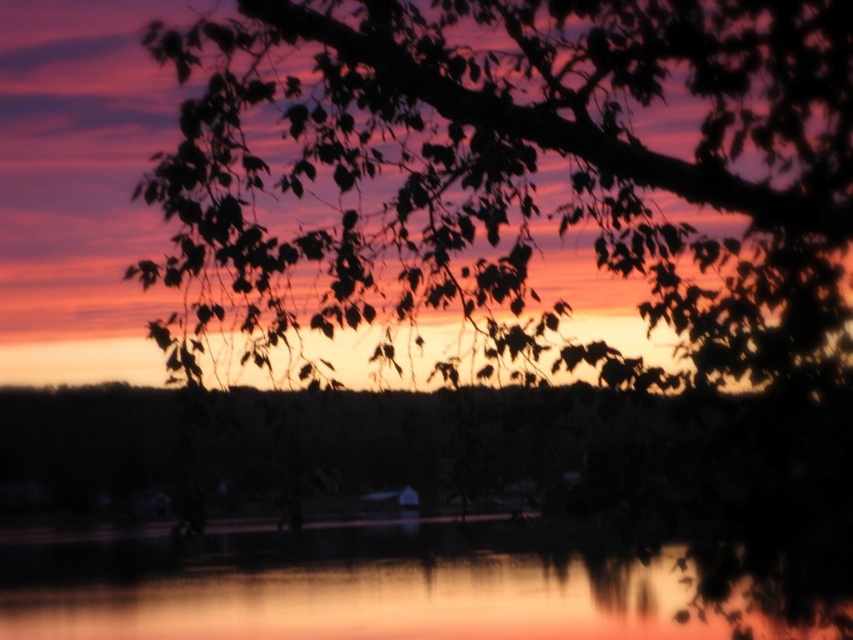
Where is `silhouette leaves at upper center`? The height and width of the screenshot is (640, 853). silhouette leaves at upper center is located at coordinates (526, 156).

Does silhouette leaves at upper center appear over smooth water at center?

Yes, silhouette leaves at upper center is above smooth water at center.

Measure the distance between silhouette leaves at upper center and camera.

silhouette leaves at upper center and camera are 19.79 feet apart.

At what (x,y) coordinates should I click in order to perform the action: click on silhouette leaves at upper center. Please return your answer as a coordinate pair (x, y). The image size is (853, 640). Looking at the image, I should click on (526, 156).